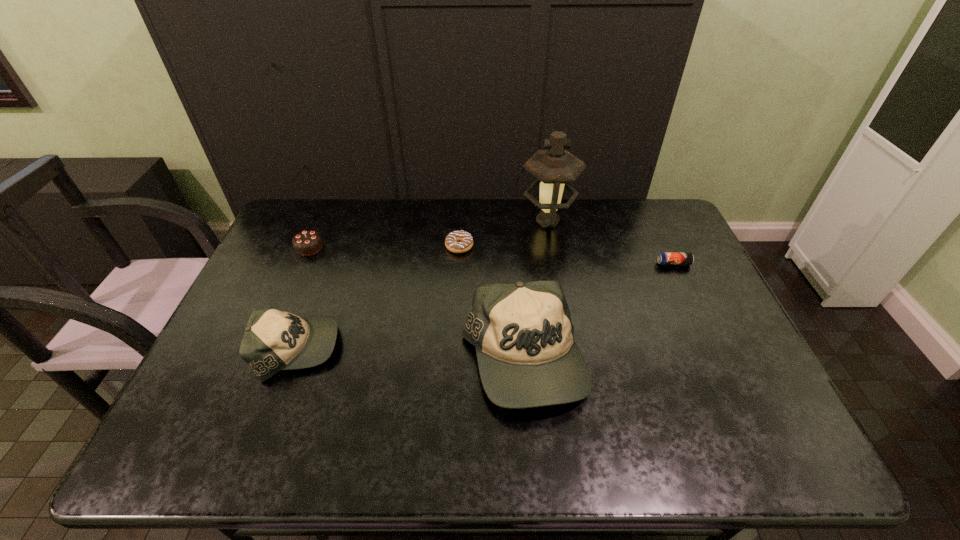
The width and height of the screenshot is (960, 540). Identify the location of unoccupied area between the third nearest object and the fifth shortest object. (598, 312).

Where is `empty space that is in between the fourth tallest object and the taller baseball cap`? empty space that is in between the fourth tallest object and the taller baseball cap is located at coordinates (416, 304).

At what (x,y) coordinates should I click in order to perform the action: click on free space between the doughnut and the third tallest object. Please return your answer as a coordinate pair (x, y). This screenshot has width=960, height=540. Looking at the image, I should click on (378, 298).

Locate an element on the screen. The image size is (960, 540). vacant space that is in between the farthest object and the rightmost object is located at coordinates (611, 242).

The height and width of the screenshot is (540, 960). I want to click on free space between the fifth shortest object and the shorter baseball cap, so click(x=410, y=355).

Find the location of a particular element. This screenshot has width=960, height=540. vacant area that lies between the doughnut and the tallest object is located at coordinates (503, 233).

Find the location of a particular element. vacant space in between the third tallest object and the third shortest object is located at coordinates (303, 298).

In order to click on the fourth closest object relative to the right baseball cap in this screenshot , I will do `click(665, 258)`.

Identify which object is located as the fourth nearest to the oil lamp. Please provide its 2D coordinates. Your answer should be formatted as a tuple, i.e. [(x, y)], where the tuple contains the x and y coordinates of a point satisfying the conditions above.

[(273, 340)]

The height and width of the screenshot is (540, 960). I want to click on free space that satisfies the following two spatial constraints: 1. on the front side of the doughnut; 2. on the front-facing side of the left baseball cap, so click(454, 349).